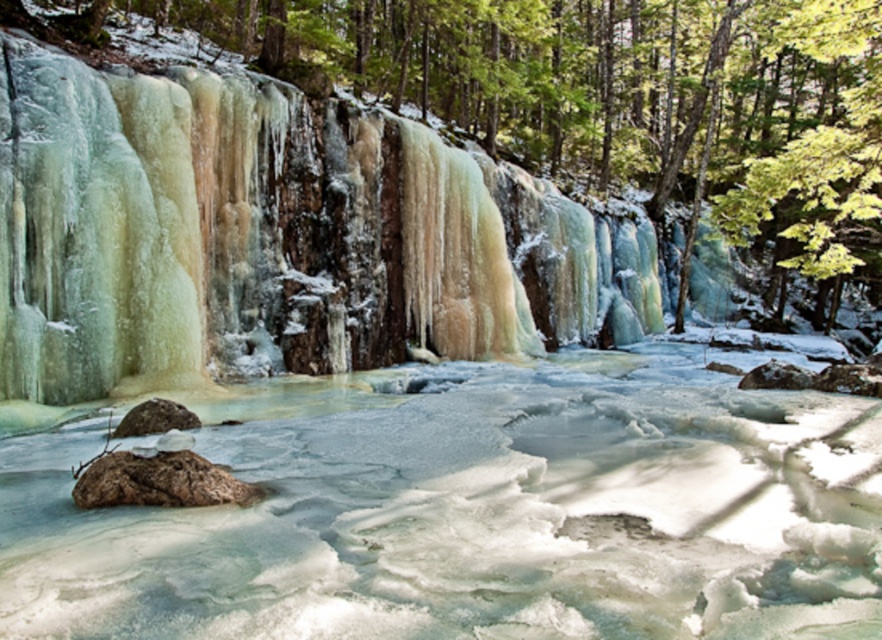
Between translucent ice water at center and brown rough rock at lower left, which one has less height?

brown rough rock at lower left is shorter.

Consider the image. Is translucent ice water at center to the left of brown rough rock at lower left from the viewer's perspective?

No, translucent ice water at center is not to the left of brown rough rock at lower left.

What do you see at coordinates (481, 515) in the screenshot? I see `translucent ice water at center` at bounding box center [481, 515].

Where is `translucent ice water at center`? translucent ice water at center is located at coordinates (481, 515).

Locate an element on the screen. This screenshot has height=640, width=882. icy translucent waterfall at center is located at coordinates (273, 236).

In the scene shown: Who is more forward, (93, 589) or (124, 118)?

Point (93, 589)

Where is `translucent ice water at center`? This screenshot has width=882, height=640. translucent ice water at center is located at coordinates click(x=481, y=515).

Identify the location of translucent ice water at center. (481, 515).